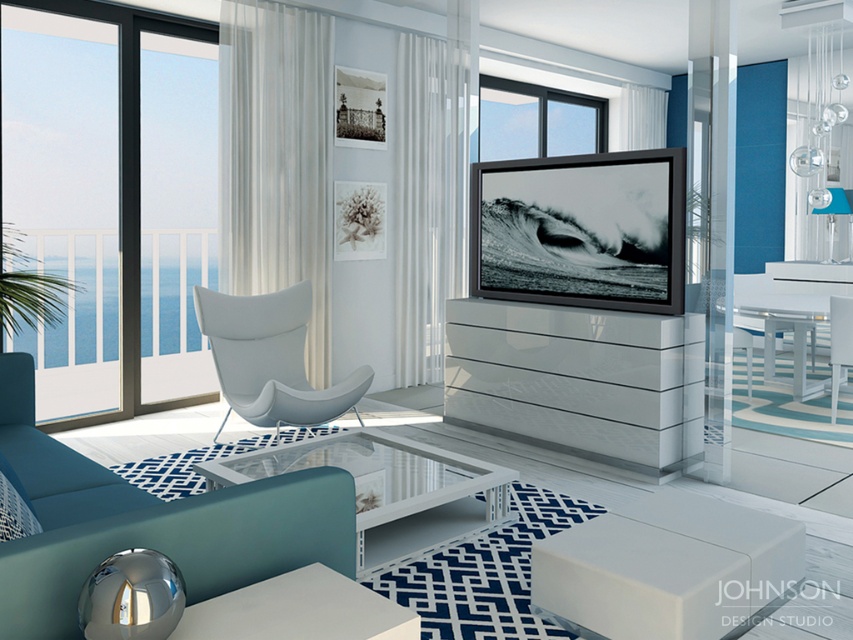
Is white leather armchair at center to the left of black glass window at upper center from the viewer's perspective?

Yes, white leather armchair at center is to the left of black glass window at upper center.

What are the coordinates of `white leather armchair at center` in the screenshot? It's located at (270, 358).

Where is `white leather armchair at center`? white leather armchair at center is located at coordinates (270, 358).

Between white leather armchair at center and white glossy chair at center, which one appears on the right side from the viewer's perspective?

white glossy chair at center is more to the right.

From the picture: Which of these two, white leather armchair at center or white glossy chair at center, stands taller?

white leather armchair at center is taller.

Identify the location of white leather armchair at center. (270, 358).

Does white glossy stool at lower center have a smaller size compared to white glossy chair at center?

Actually, white glossy stool at lower center might be larger than white glossy chair at center.

Which is behind, point (556, 593) or point (834, 330)?

Point (834, 330)

The height and width of the screenshot is (640, 853). What are the coordinates of `white glossy stool at lower center` in the screenshot? It's located at (668, 570).